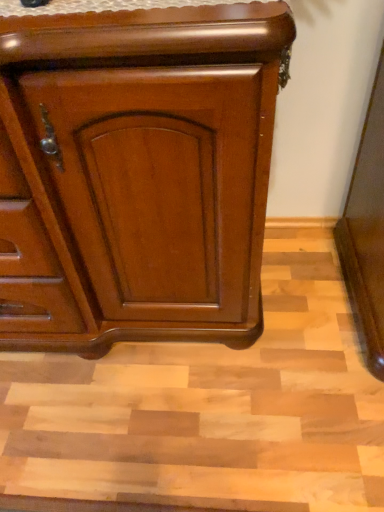
Question: Should I look upward or downward to see glossy wood chest of drawers at center?

Choices:
 (A) up
 (B) down

Answer: (A)